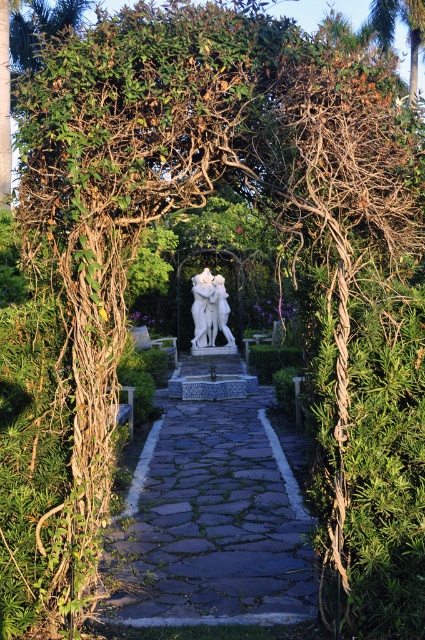
You are standing at the entrance of the garden and see the stone cobblestone path at center and the white marble sculpture at center. Which object is positioned to the right side of the other?

The stone cobblestone path at center is to the right of the white marble sculpture at center.

You are a gardener planning to place a new decorative fountain in the garden. The fountain is 2 meters wide. Considering the stone cobblestone path at center and the white marble sculpture at center, which object can accommodate the fountain in terms of size?

The stone cobblestone path at center has a larger size compared to the white marble sculpture at center, so the fountain can be placed near the stone cobblestone path at center since it is bigger in size.